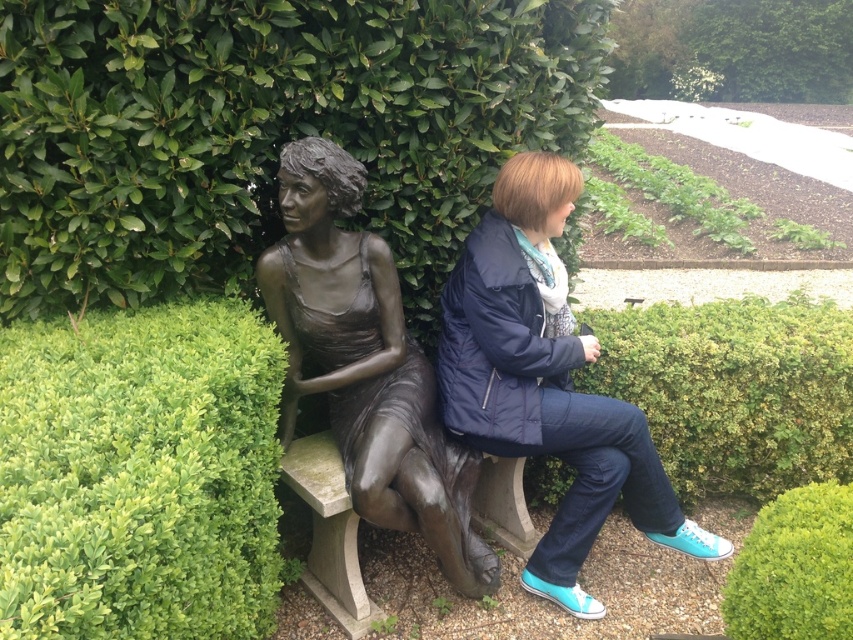
You are standing in the garden and want to take a photo of the matte blue jacket at center and the green leafy hedge at right. To ensure both are in the frame, should you position yourself to the left or right of the hedge?

You should position yourself to the right of the green leafy hedge at right because the matte blue jacket at center is to the left of the hedge, so placing yourself on the right side will allow both objects to be captured in the same frame.

You are standing in the garden and want to take a photo of the bronze statue at center without the green leafy hedge at center blocking the view. Which direction should you move to position yourself so the hedge is out of frame?

Move to the right side of the bronze statue at center so that the green leafy hedge at center, which is located to the left of the statue, will be out of the frame.

You are a gardener who wants to place a new decorative pot between the green leafy hedge at center and the bronze statue at center. The pot is 18 inches wide. Will there be enough space between them to fit the pot?

The green leafy hedge at center is 19.62 inches away from the bronze statue at center. Since the pot is 18 inches wide, there is enough space to place it between them.